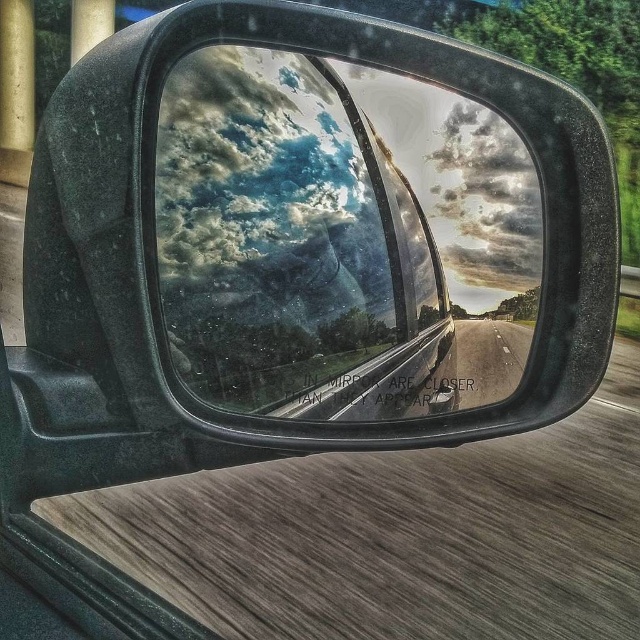
Looking at this image, you are a passenger in a car and looking at the transparent glass car window at center and the asphalt road at center reflected in the side mirror. Which object in the reflection takes up more space?

The transparent glass car window at center takes up more space in the reflection than the asphalt road at center because it has a larger size.

You are driving a car and want to check if there is enough space between the transparent glass car window at center and the asphalt road at center to safely pass through a narrow alleyway that is 12 inches wide. Can you fit through based on the distance shown in the scene?

The transparent glass car window at center and asphalt road at center are 11.90 inches apart, which is slightly less than the 12 inches width of the alleyway. Therefore, there might not be enough space to safely pass through the alleyway as the distance is just under the required width.

Based on the photo, you are a passenger in a car and want to check the transparent glass car window at center. Based on its position at point coordinates, where exactly should you look in the car?

The transparent glass car window at center is located at point coordinates of 0.383 on the x axis and 0.455 on the y axis.